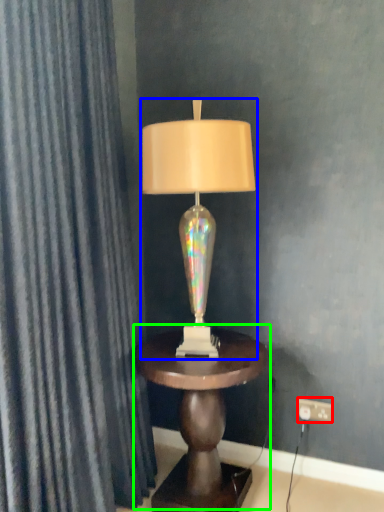
Question: Based on their relative distances, which object is nearer to electric outlet (highlighted by a red box)? Choose from lamp (highlighted by a blue box) and table (highlighted by a green box).

Choices:
 (A) lamp
 (B) table

Answer: (B)